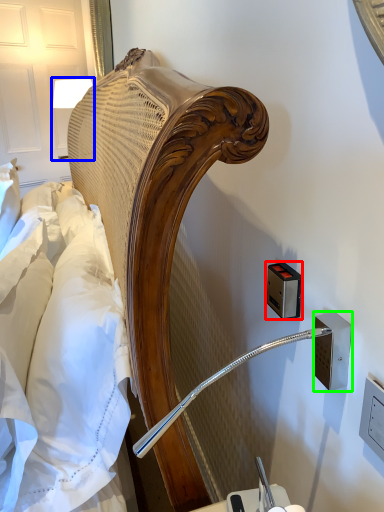
Question: Which object is positioned farthest from electric outlet (highlighted by a red box)? Select from bedside lamp (highlighted by a blue box) and electric outlet (highlighted by a green box).

Choices:
 (A) bedside lamp
 (B) electric outlet

Answer: (A)